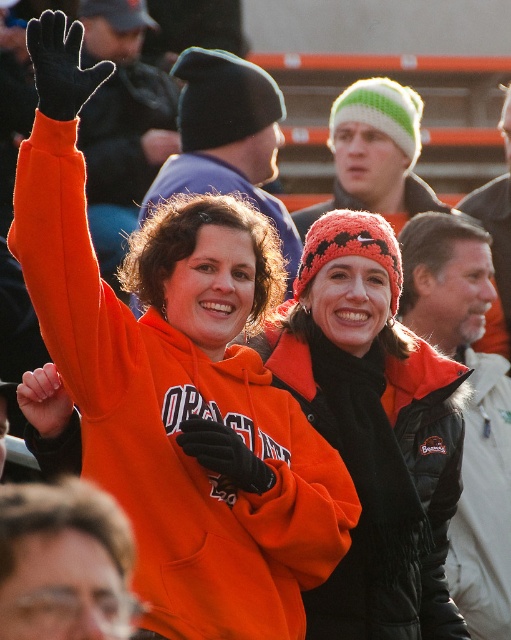
Question: Can you confirm if orange fleece sweatshirt at upper left is smaller than knitted wool beanie at center?

Choices:
 (A) yes
 (B) no

Answer: (B)

Question: Does orange fleece sweatshirt at upper left have a lesser width compared to knitted wool beanie at center?

Choices:
 (A) no
 (B) yes

Answer: (A)

Question: Is orange fleece sweatshirt at upper left further to camera compared to knitted wool beanie at center?

Choices:
 (A) yes
 (B) no

Answer: (B)

Question: Among these points, which one is farthest from the camera?

Choices:
 (A) (290, 573)
 (B) (272, 378)

Answer: (B)

Question: Which point is closer to the camera?

Choices:
 (A) orange fleece sweatshirt at upper left
 (B) knitted wool beanie at center

Answer: (A)

Question: Among these objects, which one is farthest from the camera?

Choices:
 (A) knitted wool beanie at center
 (B) orange fleece sweatshirt at upper left

Answer: (A)